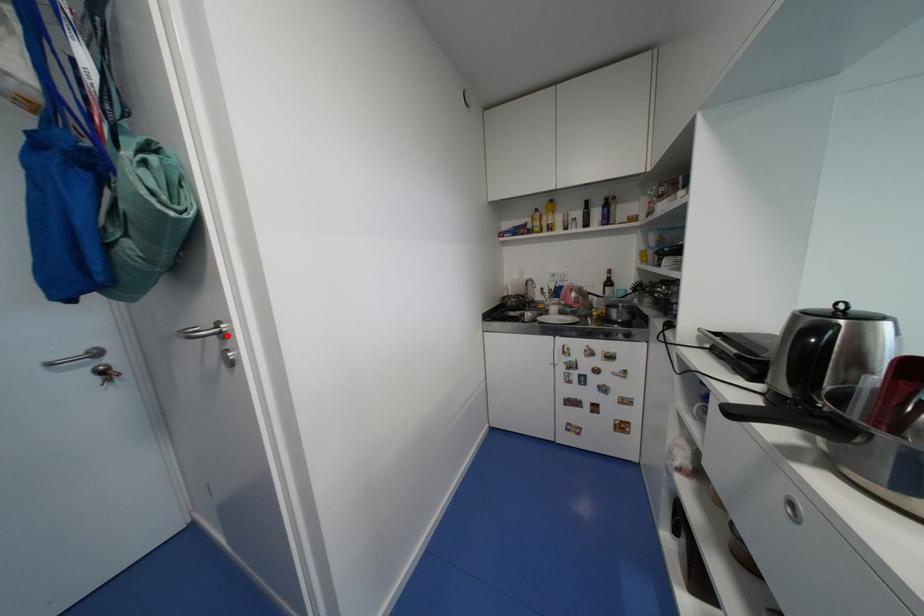
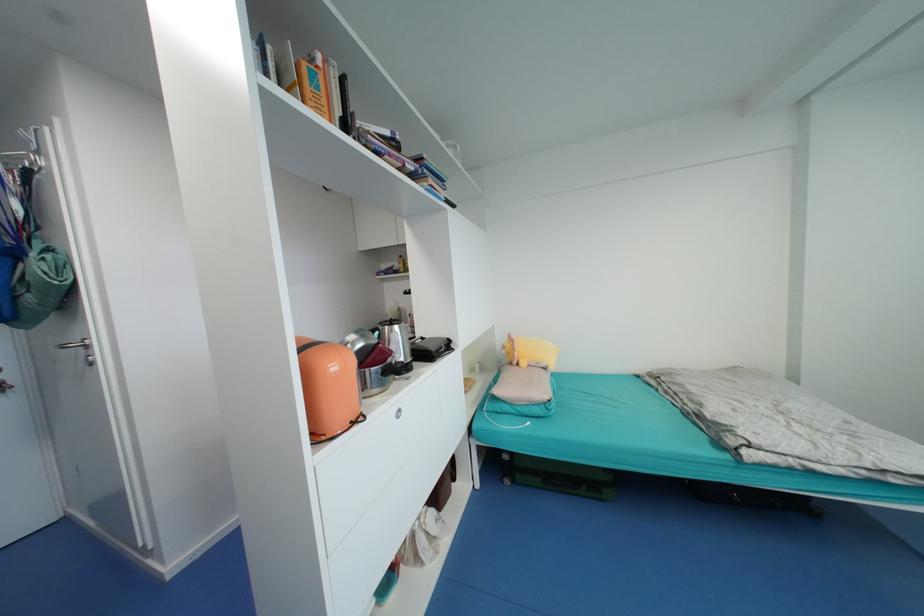
Where in the second image is the point corresponding to the highlighted location from the first image?

(91, 347)